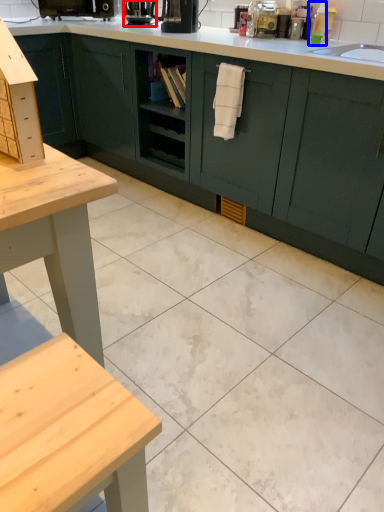
Question: Which object is further to the camera taking this photo, coffee machine (highlighted by a red box) or toiletry (highlighted by a blue box)?

Choices:
 (A) coffee machine
 (B) toiletry

Answer: (A)